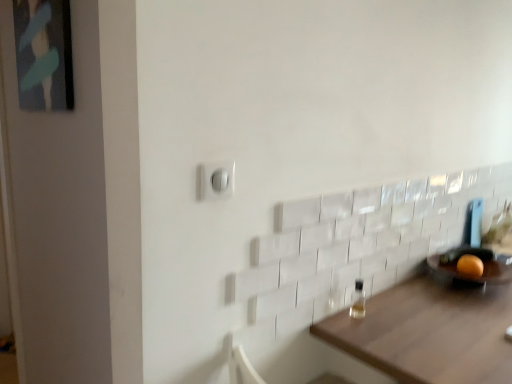
Where is `matte black picture frame at upper left`? matte black picture frame at upper left is located at coordinates (44, 54).

You are a GUI agent. You are given a task and a screenshot of the screen. Output one action in this format:
    pyautogui.click(x=<x>, y=<y>)
    Task: Click on the white plastic light switch at center
    The width and height of the screenshot is (512, 384).
    Given the screenshot: What is the action you would take?
    pyautogui.click(x=216, y=180)

Where is `orange matte at right`? orange matte at right is located at coordinates (470, 266).

Image resolution: width=512 pixels, height=384 pixels. Identify the location of matte black picture frame at upper left. (44, 54).

From a real-world perspective, who is located higher, white plastic light switch at center or brown wooden table at lower right?

white plastic light switch at center is physically above.

Considering the sizes of objects white plastic light switch at center and brown wooden table at lower right in the image provided, who is smaller, white plastic light switch at center or brown wooden table at lower right?

Smaller between the two is white plastic light switch at center.

Is white plastic light switch at center positioned with its back to brown wooden table at lower right?

No.

Considering the points (215, 178) and (361, 358), which point is behind, point (215, 178) or point (361, 358)?

The point (361, 358) is farther from the camera.

Identify the location of light switch that appears in front of the orange matte at right. (216, 180).

Considering the sizes of objects orange matte at right and white plastic light switch at center in the image provided, who is taller, orange matte at right or white plastic light switch at center?

white plastic light switch at center.

Is orange matte at right facing towards white plastic light switch at center?

No, orange matte at right does not turn towards white plastic light switch at center.

Between orange matte at right and white plastic light switch at center, which one has larger width?

Wider between the two is orange matte at right.

Is white plastic light switch at center thinner than transparent glass bottle at lower right?

Indeed, white plastic light switch at center has a lesser width compared to transparent glass bottle at lower right.

You are a GUI agent. You are given a task and a screenshot of the screen. Output one action in this format:
    pyautogui.click(x=<x>, y=<y>)
    Task: Click on the light switch lying in front of the transparent glass bottle at lower right
    
    Given the screenshot: What is the action you would take?
    pyautogui.click(x=216, y=180)

How distant is white plastic light switch at center from transparent glass bottle at lower right?

white plastic light switch at center is 65.14 centimeters away from transparent glass bottle at lower right.

Does point (213, 164) appear closer or farther from the camera than point (356, 311)?

Point (213, 164) is positioned closer to the camera compared to point (356, 311).

Is brown wooden table at lower right far away from transparent glass bottle at lower right?

brown wooden table at lower right is actually quite close to transparent glass bottle at lower right.

Considering the positions of objects brown wooden table at lower right and transparent glass bottle at lower right in the image provided, who is more to the right, brown wooden table at lower right or transparent glass bottle at lower right?

brown wooden table at lower right is more to the right.

Would you say brown wooden table at lower right contains transparent glass bottle at lower right?

Actually, transparent glass bottle at lower right is outside brown wooden table at lower right.

Is point (467, 254) less distant than point (23, 23)?

No.

Considering the relative sizes of orange matte at right and matte black picture frame at upper left in the image provided, is orange matte at right thinner than matte black picture frame at upper left?

Incorrect, the width of orange matte at right is not less than that of matte black picture frame at upper left.

From the image's perspective, is orange matte at right under matte black picture frame at upper left?

Correct, orange matte at right appears lower than matte black picture frame at upper left in the image.

Which of these two, brown wooden table at lower right or matte black picture frame at upper left, is thinner?

Thinner between the two is matte black picture frame at upper left.

Is brown wooden table at lower right next to matte black picture frame at upper left and touching it?

No, brown wooden table at lower right is not beside matte black picture frame at upper left.

Does brown wooden table at lower right turn towards matte black picture frame at upper left?

No.

Is brown wooden table at lower right at the right side of matte black picture frame at upper left?

Correct, you'll find brown wooden table at lower right to the right of matte black picture frame at upper left.

From a real-world perspective, is matte black picture frame at upper left physically located above or below orange matte at right?

In terms of real-world spatial position, matte black picture frame at upper left is above orange matte at right.

Between matte black picture frame at upper left and orange matte at right, which one is positioned behind?

orange matte at right is further from the camera.

Looking at this image, do you think matte black picture frame at upper left is within orange matte at right, or outside of it?

matte black picture frame at upper left is not inside orange matte at right, it's outside.

Looking at this image, from the image's perspective, is matte black picture frame at upper left beneath orange matte at right?

No, from the image's perspective, matte black picture frame at upper left is not beneath orange matte at right.

I want to click on table beneath the white plastic light switch at center (from a real-world perspective), so click(x=430, y=332).

Locate an element on the screen. light switch in front of the orange matte at right is located at coordinates (216, 180).

Which object lies further to the anchor point matte black picture frame at upper left, orange matte at right or transparent glass bottle at lower right?

orange matte at right.

When comparing their distances from orange matte at right, does transparent glass bottle at lower right or white plastic light switch at center seem closer?

The object closer to orange matte at right is transparent glass bottle at lower right.

Which object lies nearer to the anchor point transparent glass bottle at lower right, orange matte at right or matte black picture frame at upper left?

Among the two, orange matte at right is located nearer to transparent glass bottle at lower right.

When comparing their distances from white plastic light switch at center, does orange matte at right or brown wooden table at lower right seem closer?

brown wooden table at lower right is closer to white plastic light switch at center.

From the picture: Considering their positions, is brown wooden table at lower right positioned further to transparent glass bottle at lower right than white plastic light switch at center?

The object further to transparent glass bottle at lower right is white plastic light switch at center.

Considering their positions, is transparent glass bottle at lower right positioned closer to white plastic light switch at center than orange matte at right?

transparent glass bottle at lower right is positioned closer to the anchor white plastic light switch at center.

From the image, which object appears to be nearer to white plastic light switch at center, orange matte at right or matte black picture frame at upper left?

Based on the image, matte black picture frame at upper left appears to be nearer to white plastic light switch at center.

Looking at the image, which one is located closer to transparent glass bottle at lower right, matte black picture frame at upper left or brown wooden table at lower right?

brown wooden table at lower right.

The width and height of the screenshot is (512, 384). I want to click on light switch situated between matte black picture frame at upper left and orange matte at right from left to right, so click(216, 180).

At what (x,y) coordinates should I click in order to perform the action: click on bottle between brown wooden table at lower right and orange matte at right in the front-back direction. Please return your answer as a coordinate pair (x, y). The width and height of the screenshot is (512, 384). Looking at the image, I should click on (358, 300).

The height and width of the screenshot is (384, 512). Identify the location of orange between matte black picture frame at upper left and brown wooden table at lower right from left to right. (470, 266).

Identify the location of orange between white plastic light switch at center and brown wooden table at lower right in the horizontal direction. (470, 266).